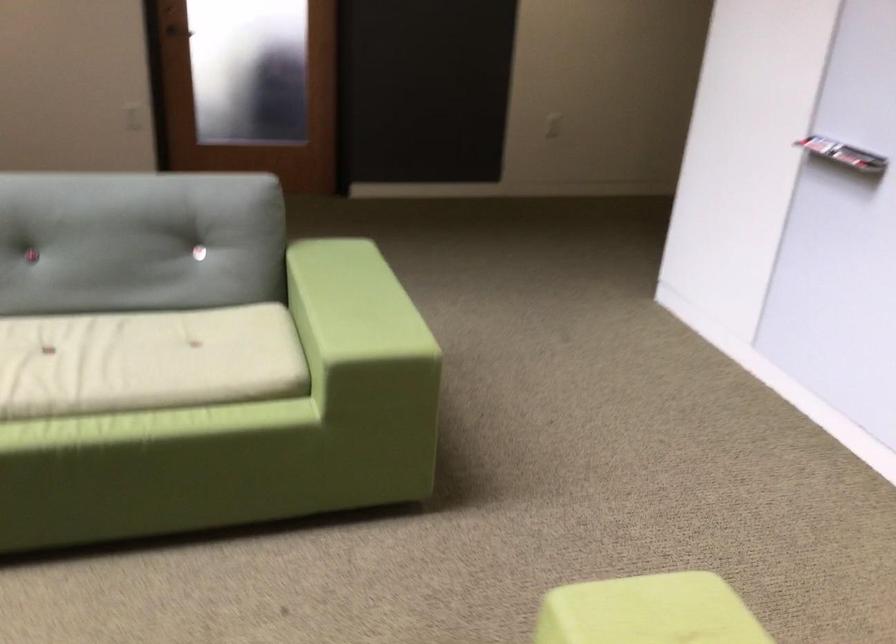
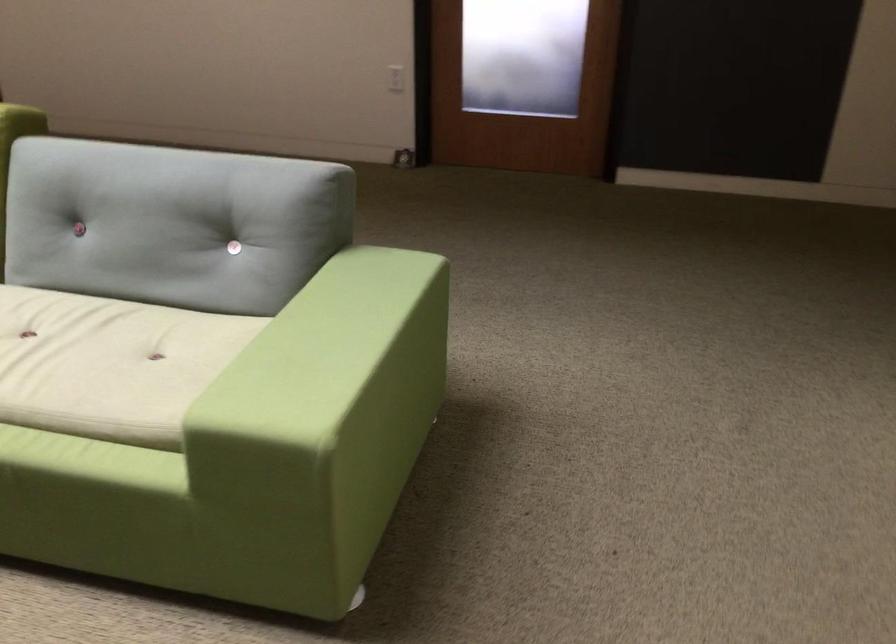
Find the pixel in the second image that matches pixel 362 305 in the first image.

(323, 353)